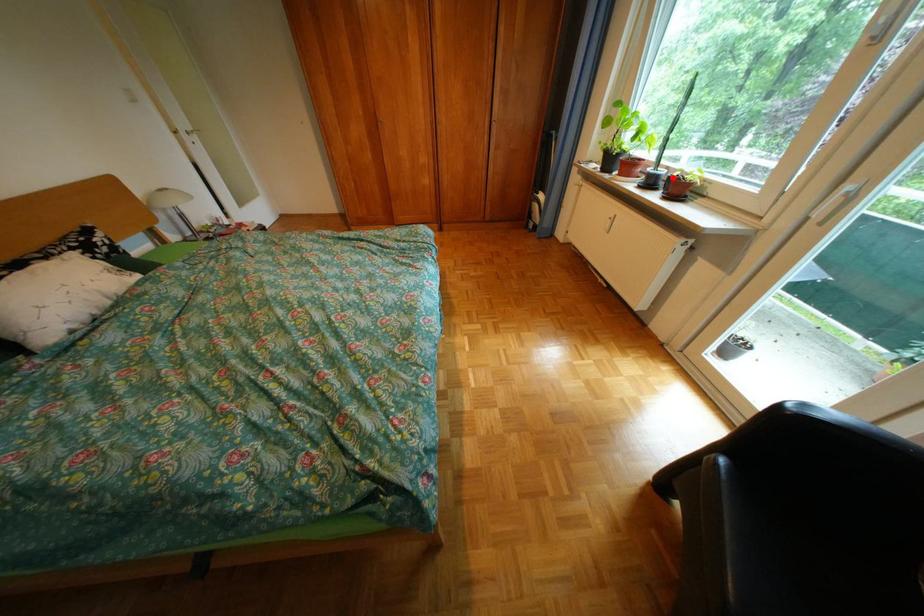
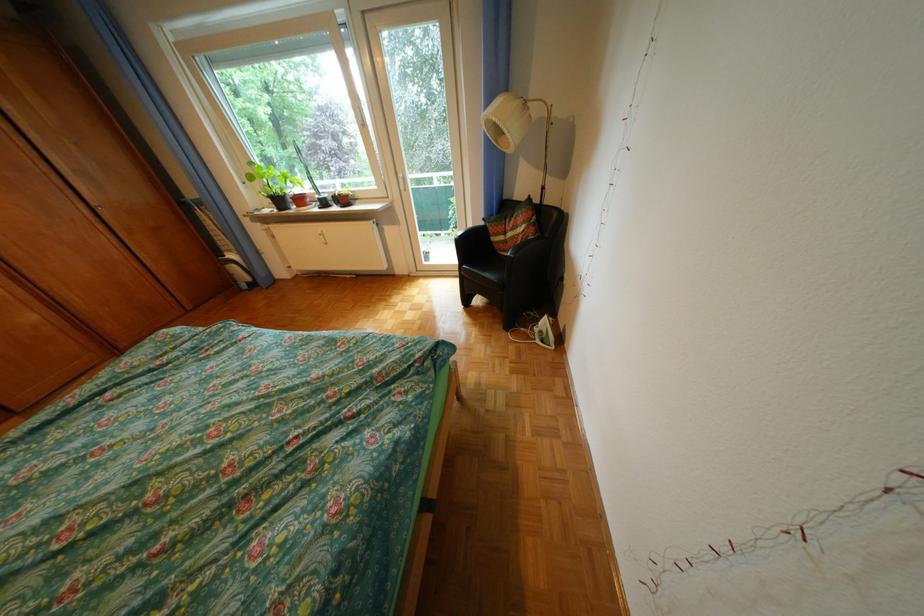
Find the pixel in the second image that matches the highlighted location in the first image.

(341, 199)